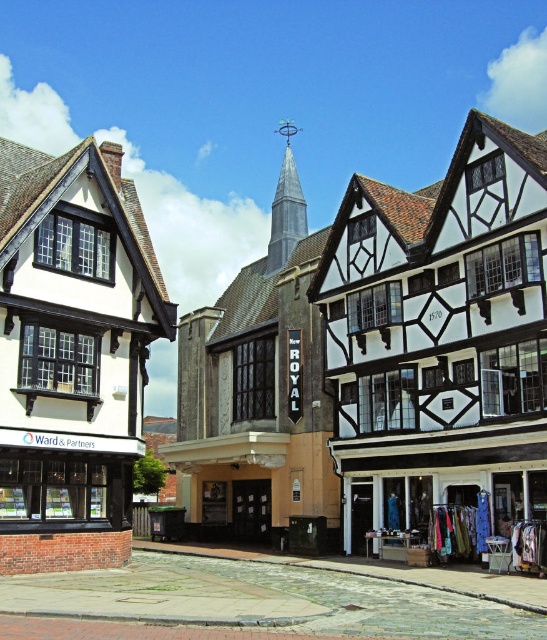
Between white timber-framed building at center and textured fabric clothes at lower right, which one appears on the left side from the viewer's perspective?

white timber-framed building at center

Who is higher up, white timber-framed building at center or textured fabric clothes at lower right?

white timber-framed building at center

Find the location of `white timber-framed building at center`. white timber-framed building at center is located at coordinates (282, 356).